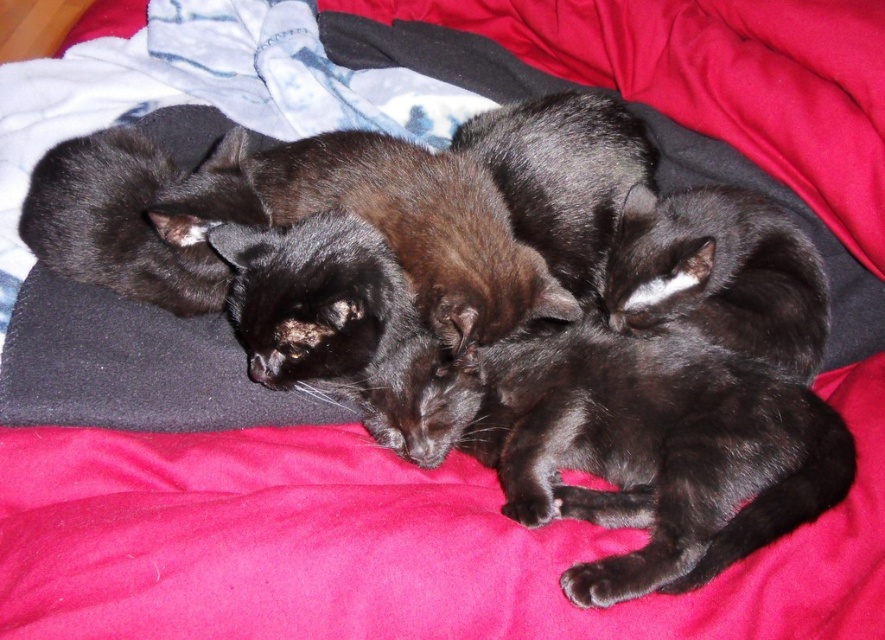
You are a photographer standing in the room where the shiny black cat at center is sleeping. You want to take a closeup photo of the cat without disturbing it. Considering the distance between you and the cat, what is the minimum focal length lens you should use if your camera has a sensor size of 24mm width and you want to fill the frame horizontally? Assume the cat occupies 15cm of the scene width.

The minimum focal length lens required is approximately 18.3mm. This is calculated by multiplying the sensor width of 24mm by the distance to the subject divided by the subject width. Here, the distance is 93.95cm and the subject width is 15cm, so 24mm x 93.95cm divided by 15cm equals approximately 18.3mm.